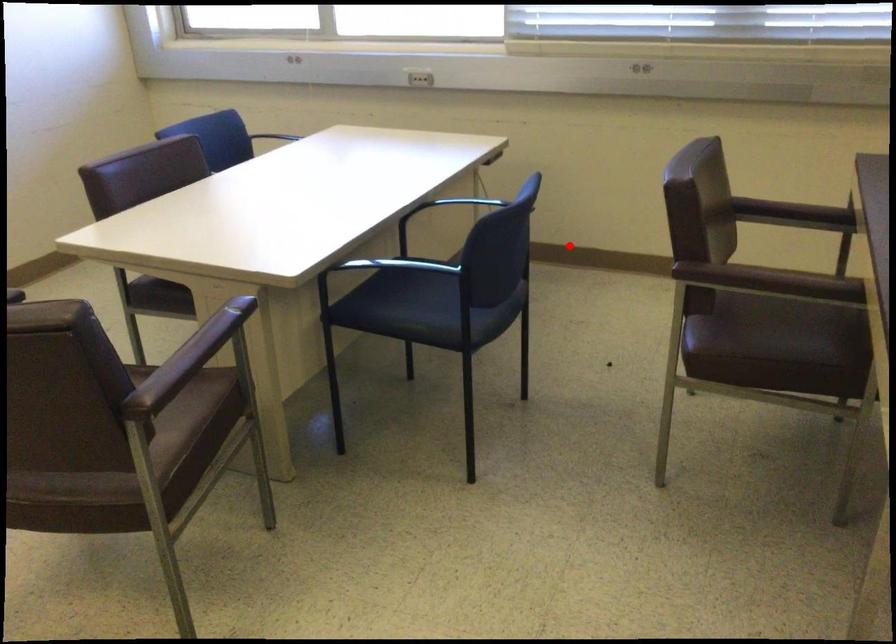
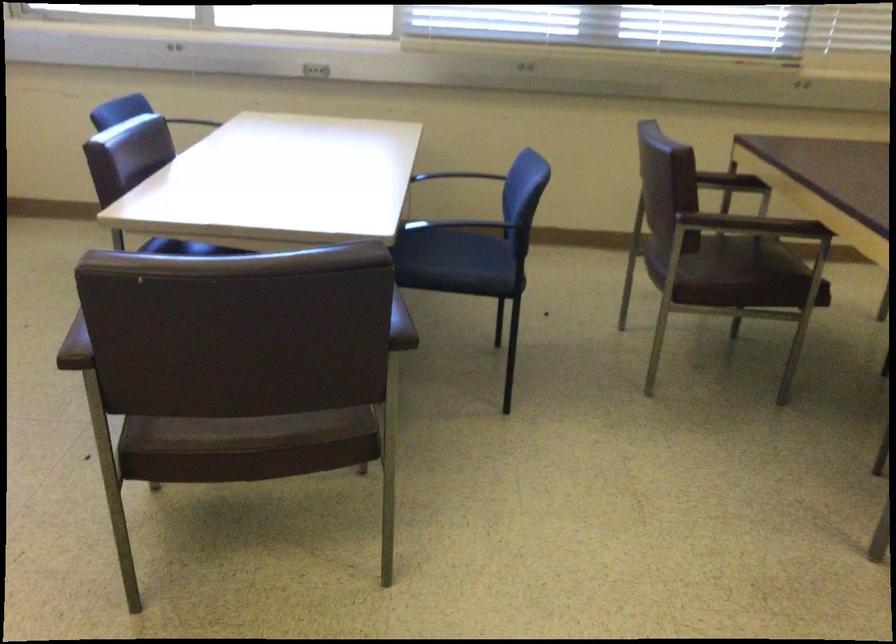
Where in the second image is the point corresponding to the highlighted location from the first image?

(466, 230)